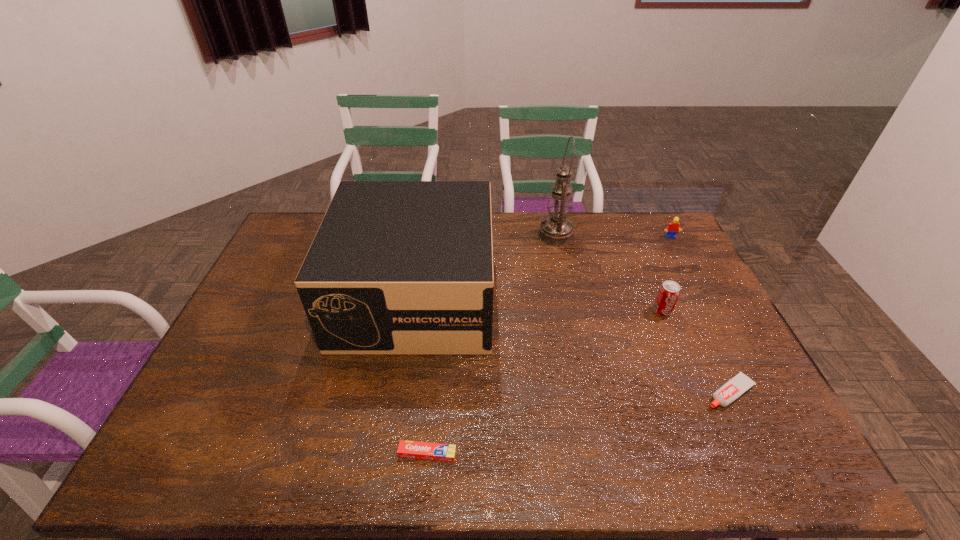
Find the location of a particular element. The image size is (960, 540). free spot that satisfies the following two spatial constraints: 1. on the front-facing side of the fourth shortest object; 2. on the left side of the fifth shortest object is located at coordinates (413, 311).

At what (x,y) coordinates should I click in order to perform the action: click on blank space that satisfies the following two spatial constraints: 1. on the front-facing side of the farther toothpaste; 2. on the left side of the box. Please return your answer as a coordinate pair (x, y). The height and width of the screenshot is (540, 960). Looking at the image, I should click on (400, 393).

Where is `free location that satisfies the following two spatial constraints: 1. on the front side of the tallest object; 2. on the left side of the soda can`? free location that satisfies the following two spatial constraints: 1. on the front side of the tallest object; 2. on the left side of the soda can is located at coordinates (572, 311).